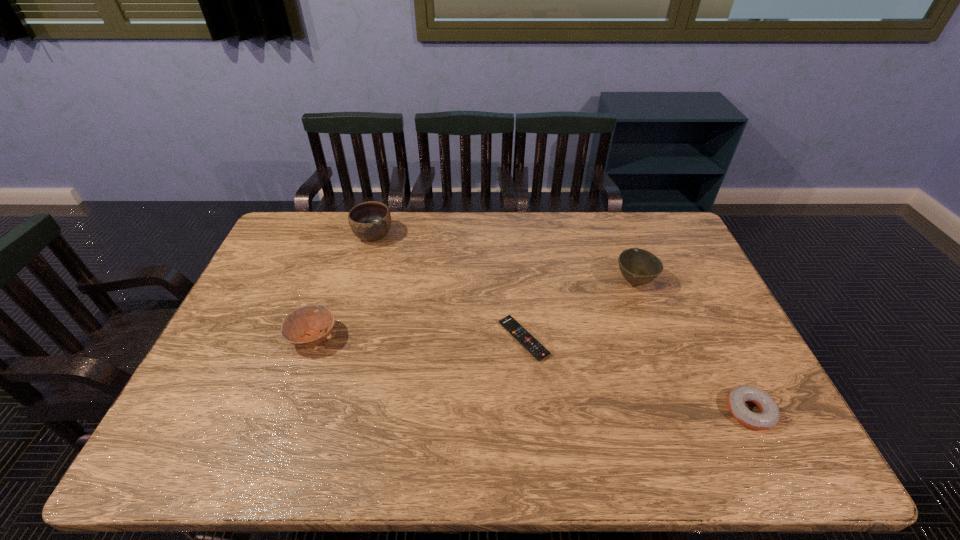
You are a GUI agent. You are given a task and a screenshot of the screen. Output one action in this format:
    pyautogui.click(x=<x>, y=<y>)
    Task: Click on the vacant area at the near edge
    The width and height of the screenshot is (960, 540).
    Given the screenshot: What is the action you would take?
    click(x=661, y=433)

Find the location of a particular element. vacant space at the left edge is located at coordinates (243, 337).

The image size is (960, 540). Find the location of `free space at the right edge`. free space at the right edge is located at coordinates coord(698,323).

In the image, there is a desktop. At what (x,y) coordinates should I click in order to perform the action: click on vacant area at the far left corner. Please return your answer as a coordinate pair (x, y). Looking at the image, I should click on pos(276,248).

The height and width of the screenshot is (540, 960). What are the coordinates of `free space at the far right corner of the desktop` in the screenshot? It's located at (670, 229).

Identify the location of unoccupied area between the second farthest bowl and the farthest bowl. Image resolution: width=960 pixels, height=540 pixels. (504, 258).

The width and height of the screenshot is (960, 540). In order to click on empty location between the nearest bowl and the rightmost bowl in this screenshot , I will do [474, 309].

You are a GUI agent. You are given a task and a screenshot of the screen. Output one action in this format:
    pyautogui.click(x=<x>, y=<y>)
    Task: Click on the empty location between the shortest bowl and the second object from right to left
    
    Given the screenshot: What is the action you would take?
    pyautogui.click(x=474, y=309)

Locate an element on the screen. This screenshot has height=540, width=960. free area in between the rightmost object and the farthest bowl is located at coordinates (562, 323).

Where is `vacant space in between the third tallest object and the nearest object`? vacant space in between the third tallest object and the nearest object is located at coordinates (532, 374).